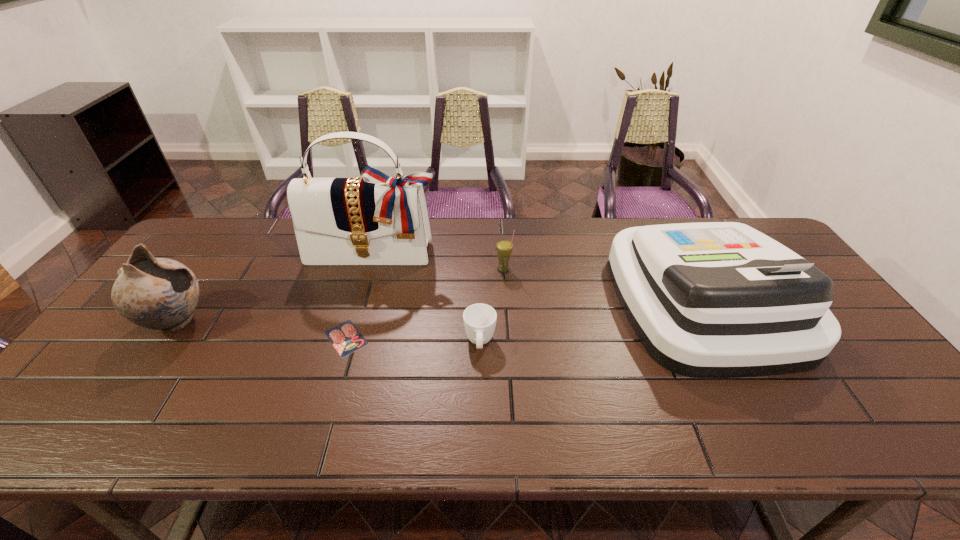
Where is `free space located 0.210m from the spout of the leftmost object`? The image size is (960, 540). free space located 0.210m from the spout of the leftmost object is located at coordinates (x=288, y=322).

Find the location of `vacant area located 0.170m on the right of the fifth object from left to right`. vacant area located 0.170m on the right of the fifth object from left to right is located at coordinates (568, 269).

At what (x,y) coordinates should I click in order to perform the action: click on vacant region located 0.080m with the handle on the side of the fifth tallest object. Please return your answer as a coordinate pair (x, y). The width and height of the screenshot is (960, 540). Looking at the image, I should click on (480, 389).

Identify the location of vacant space located 0.310m on the left of the salami. (203, 338).

Locate an element on the screen. satchel situated at the far edge is located at coordinates (373, 219).

The image size is (960, 540). Find the location of `cash register present at the far edge`. cash register present at the far edge is located at coordinates (714, 299).

I want to click on object present at the left edge, so click(161, 294).

Image resolution: width=960 pixels, height=540 pixels. Find the location of `object that is at the right edge`. object that is at the right edge is located at coordinates (714, 299).

Where is `object at the far right corner`? object at the far right corner is located at coordinates (714, 299).

Identify the location of free space at the far edge of the desktop. (540, 249).